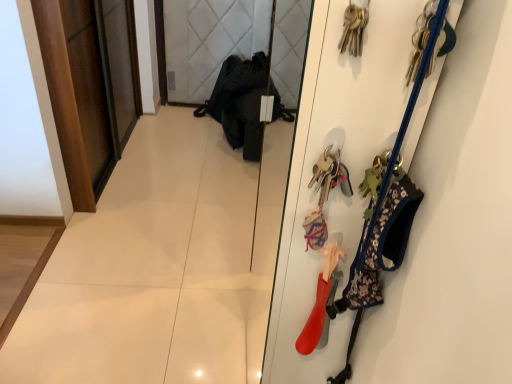
Where is `vacant space to the right of dark wood door at left`? This screenshot has height=384, width=512. vacant space to the right of dark wood door at left is located at coordinates (191, 178).